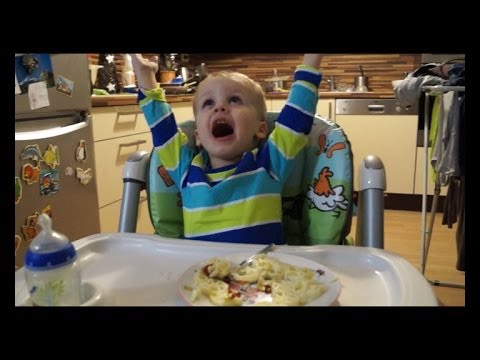
Identify the location of refrigerator. (72, 206).